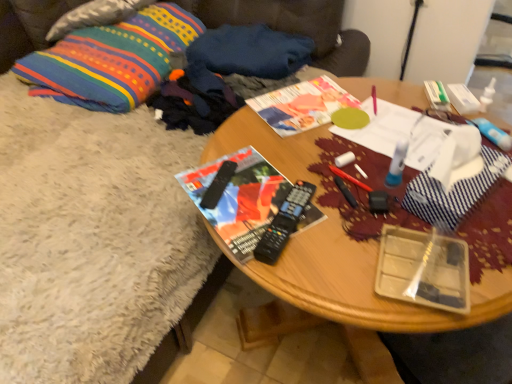
Locate an element on the screen. The width and height of the screenshot is (512, 384). free point in front of textured cotton pillow at upper left, which is counted as the 2th pillow, starting from the bottom is located at coordinates (97, 44).